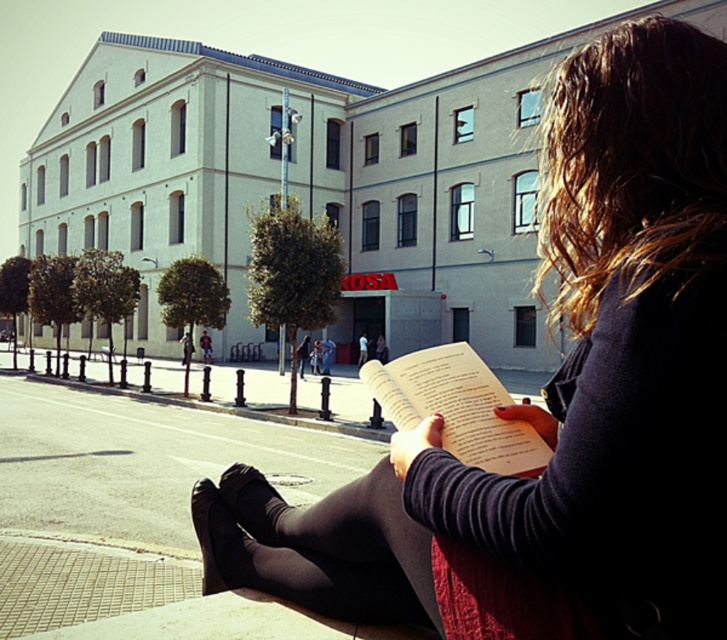
Question: Estimate the real-world distances between objects in this image. Which object is farther from the white paper book at center?

Choices:
 (A) black tights at lower center
 (B) matte black book at center

Answer: (B)

Question: Which of the following is the farthest from the observer?

Choices:
 (A) (449, 444)
 (B) (704, 310)
 (C) (389, 492)

Answer: (C)

Question: Which of the following is the farthest from the observer?

Choices:
 (A) black tights at lower center
 (B) matte black book at center

Answer: (A)

Question: Can you confirm if matte black book at center is smaller than white paper book at center?

Choices:
 (A) yes
 (B) no

Answer: (B)

Question: Is black tights at lower center behind white paper book at center?

Choices:
 (A) no
 (B) yes

Answer: (B)

Question: Is the position of matte black book at center less distant than that of black tights at lower center?

Choices:
 (A) yes
 (B) no

Answer: (A)